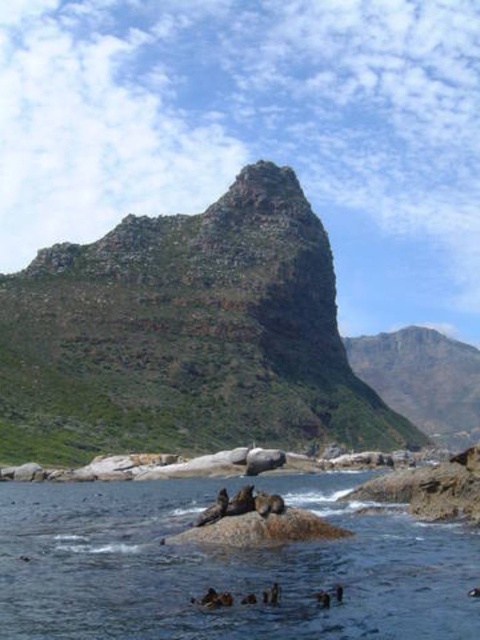
From the picture: Can you confirm if rugged rock mountain at center is positioned to the left of green rocky mountain at center?

Correct, you'll find rugged rock mountain at center to the left of green rocky mountain at center.

Does rugged rock mountain at center have a smaller size compared to green rocky mountain at center?

No, rugged rock mountain at center is not smaller than green rocky mountain at center.

Who is more distant from viewer, [299,371] or [424,348]?

Positioned behind is point [424,348].

I want to click on rugged rock mountain at center, so click(x=186, y=336).

Image resolution: width=480 pixels, height=640 pixels. Describe the element at coordinates (186, 336) in the screenshot. I see `rugged rock mountain at center` at that location.

Does point (183, 348) lie behind point (382, 593)?

Yes, point (183, 348) is behind point (382, 593).

At what (x,y) coordinates should I click in order to perform the action: click on rugged rock mountain at center. Please return your answer as a coordinate pair (x, y). Looking at the image, I should click on (186, 336).

Between point (335, 570) and point (475, 380), which one is positioned in front?

Positioned in front is point (335, 570).

Can you confirm if brown textured water at center is bigger than green rocky mountain at center?

Incorrect, brown textured water at center is not larger than green rocky mountain at center.

Image resolution: width=480 pixels, height=640 pixels. What do you see at coordinates (223, 566) in the screenshot?
I see `brown textured water at center` at bounding box center [223, 566].

This screenshot has height=640, width=480. Identify the location of brown textured water at center. (223, 566).